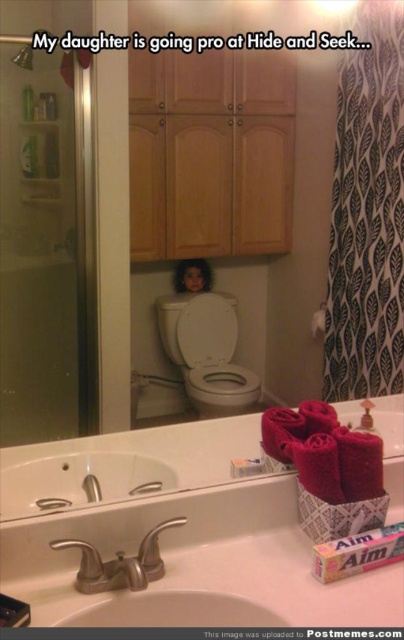
Question: Which point is closer to the camera taking this photo?

Choices:
 (A) (151, 605)
 (B) (105, 563)
 (C) (71, 211)

Answer: (A)

Question: Does white ceramic sink at lower center have a greater width compared to brushed metal faucet at lower left?

Choices:
 (A) no
 (B) yes

Answer: (B)

Question: Which point is farther to the camera?

Choices:
 (A) (14, 451)
 (B) (10, 320)
 (C) (391, 152)

Answer: (C)

Question: Does transparent glass shower door at left have a smaller size compared to smooth skin doll at center?

Choices:
 (A) no
 (B) yes

Answer: (A)

Question: Estimate the real-world distances between objects in this image. Which object is farther from the smooth skin doll at center?

Choices:
 (A) white glossy sink at center
 (B) translucent plastic bottle at upper left

Answer: (A)

Question: Is the position of black printed fabric shower curtain at right more distant than that of brushed metal faucet at sink left?

Choices:
 (A) no
 (B) yes

Answer: (B)